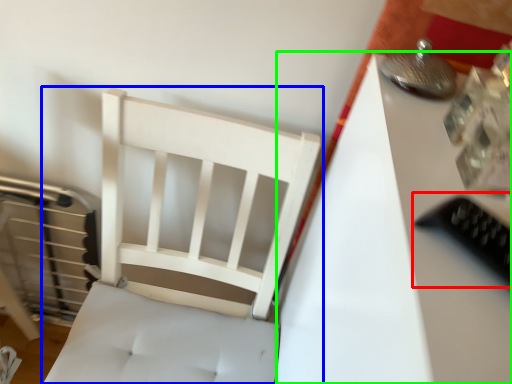
Question: Which object is positioned farthest from equipment (highlighted by a red box)? Select from furniture (highlighted by a blue box) and table (highlighted by a green box).

Choices:
 (A) furniture
 (B) table

Answer: (A)